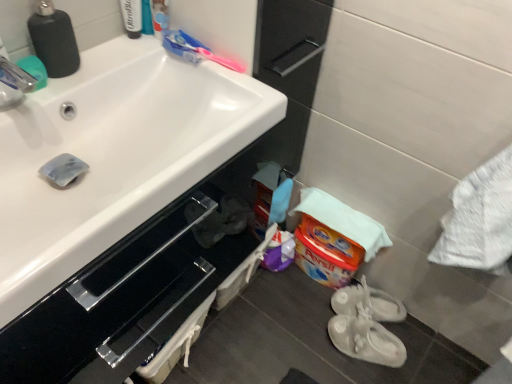
The width and height of the screenshot is (512, 384). Find the location of `vacant space that is to the left of white rubber shoes at lower right, which is the 2th footwear from back to front`. vacant space that is to the left of white rubber shoes at lower right, which is the 2th footwear from back to front is located at coordinates (308, 336).